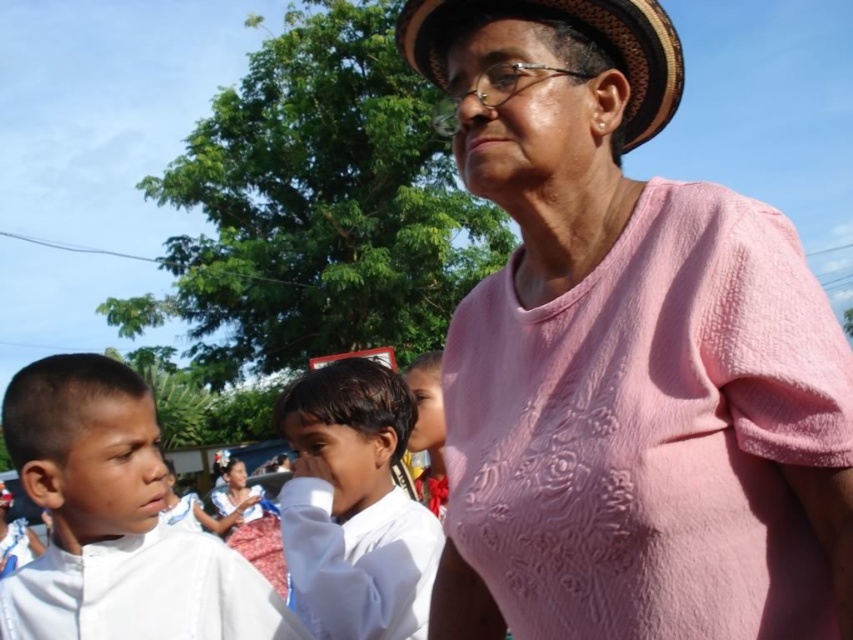
Where is `white cotton shirt at left`? This screenshot has width=853, height=640. white cotton shirt at left is located at coordinates (115, 522).

Does white cotton shirt at left have a lesser height compared to white cotton shirt at center?

Indeed, white cotton shirt at left has a lesser height compared to white cotton shirt at center.

Is point (9, 588) farther from camera compared to point (364, 417)?

No, (9, 588) is closer to viewer.

Where is `white cotton shirt at left`? This screenshot has width=853, height=640. white cotton shirt at left is located at coordinates (115, 522).

Consider the image. Can you confirm if white cotton shirt at left is thinner than red floral dress at center?

Answer: No.

Does point (48, 416) come farther from viewer compared to point (242, 547)?

No, it is in front of (242, 547).

Where is `white cotton shirt at left`? The width and height of the screenshot is (853, 640). white cotton shirt at left is located at coordinates (115, 522).

Between point (488, 541) and point (225, 472), which one is positioned behind?

Positioned behind is point (225, 472).

Where is `pink textured shirt at upper right`? This screenshot has width=853, height=640. pink textured shirt at upper right is located at coordinates (625, 356).

Does point (802, 328) lie behind point (250, 512)?

No, (802, 328) is closer to viewer.

Find the location of a particular element. pink textured shirt at upper right is located at coordinates (625, 356).